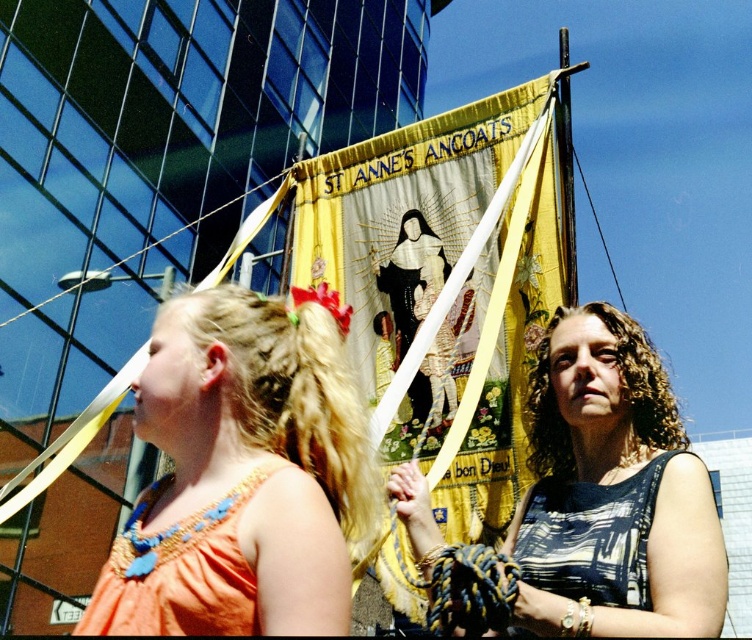
Is yellow fabric banner at center further to the viewer compared to orange fabric dress at left?

That is True.

Who is lower down, yellow fabric banner at center or orange fabric dress at left?

Positioned lower is orange fabric dress at left.

Who is more forward, (435, 346) or (223, 560)?

Point (223, 560) is in front.

The height and width of the screenshot is (640, 752). What are the coordinates of `yellow fabric banner at center` in the screenshot? It's located at (443, 285).

Can you confirm if yellow fabric banner at center is positioned to the right of printed fabric dress at center?

In fact, yellow fabric banner at center is to the left of printed fabric dress at center.

Locate an element on the screen. This screenshot has width=752, height=640. yellow fabric banner at center is located at coordinates (443, 285).

Where is `yellow fabric banner at center`? yellow fabric banner at center is located at coordinates (443, 285).

I want to click on yellow fabric banner at center, so click(443, 285).

Between point (271, 310) and point (575, 449), which one is positioned behind?

The point (575, 449) is behind.

Describe the element at coordinates (241, 476) in the screenshot. I see `orange fabric dress at left` at that location.

Between point (238, 317) and point (611, 474), which one is positioned in front?

Positioned in front is point (611, 474).

The image size is (752, 640). I want to click on orange fabric dress at left, so click(241, 476).